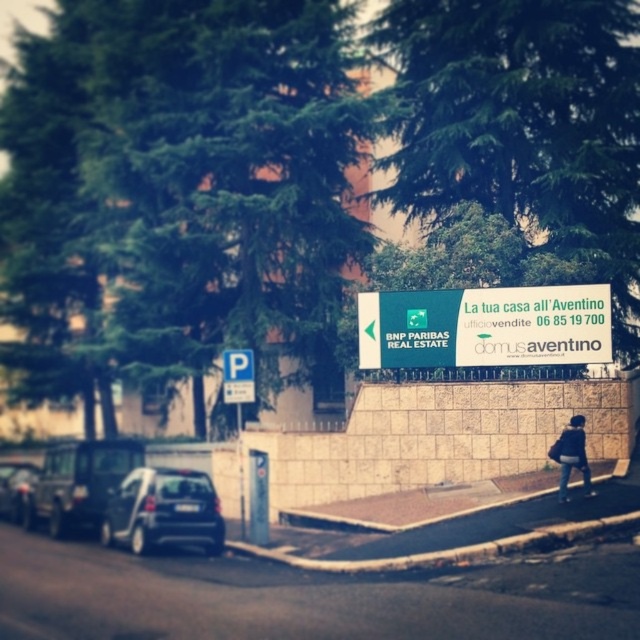
You are a drone operator trying to capture a photo of the billboard in the image. The billboard is located on a stone wall. To ensure the green leafy tree at upper center does not block the billboard in the photo, where should you position the drone relative to the tree?

The green leafy tree at upper center is located at point (522,124). To avoid blocking the billboard, position the drone so it is not directly in front of this coordinate.

You are a pedestrian standing on the sidewalk and see the dark gray metallic car at left and the green leafy tree at upper center. Which object is positioned to the right of the other?

The green leafy tree at upper center is positioned to the right of the dark gray metallic car at left.